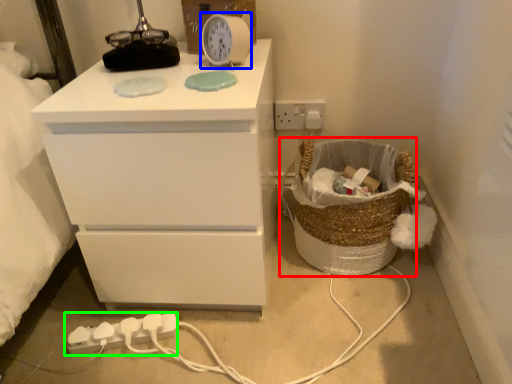
Question: Based on their relative distances, which object is nearer to basket (highlighted by a red box)? Choose from clock (highlighted by a blue box) and extension cord (highlighted by a green box).

Choices:
 (A) clock
 (B) extension cord

Answer: (A)